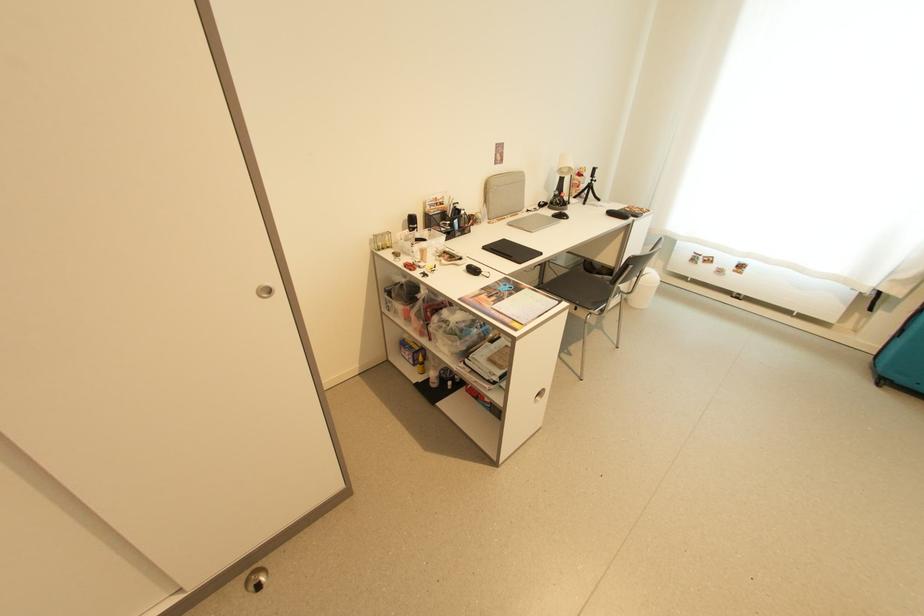
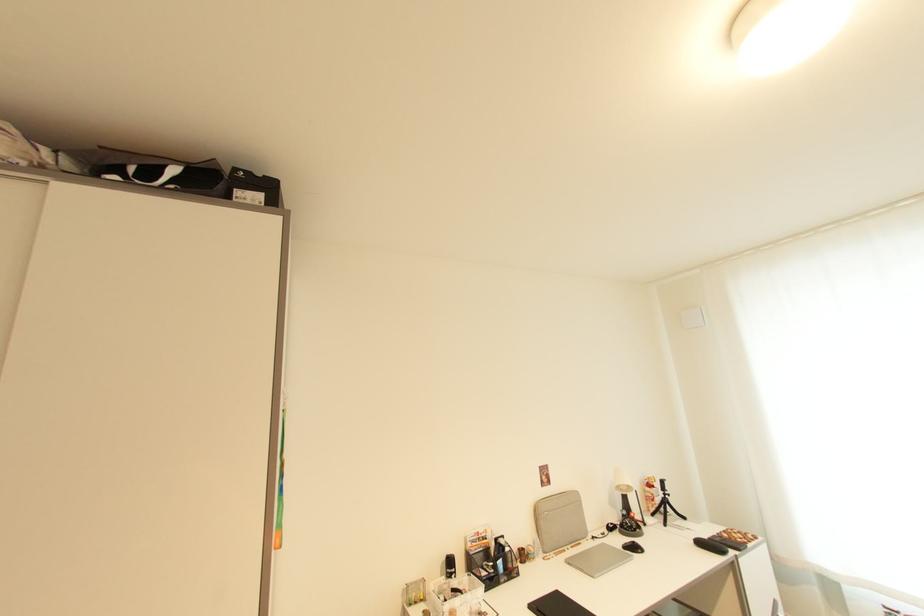
The point at (495,197) is marked in the first image. Where is the corresponding point in the second image?

(546, 525)